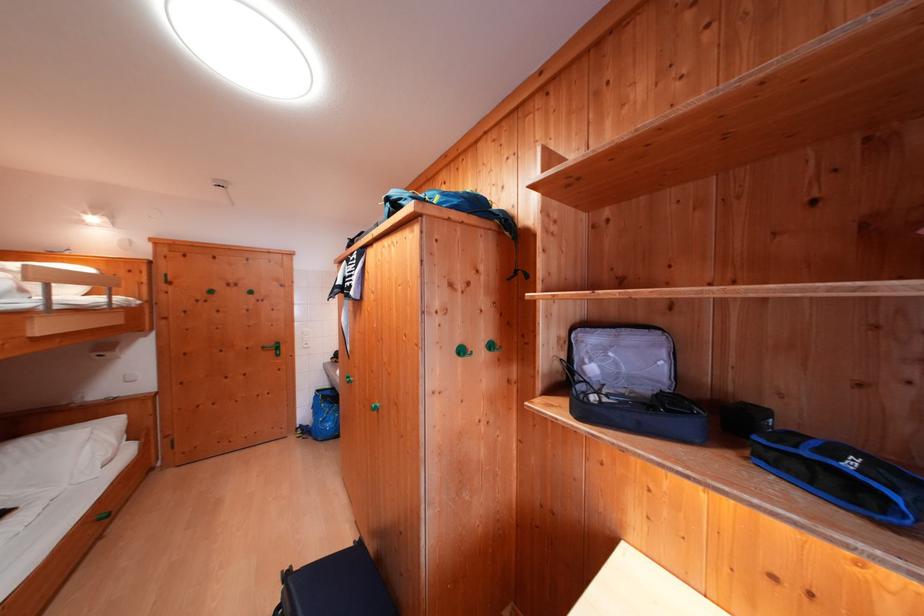
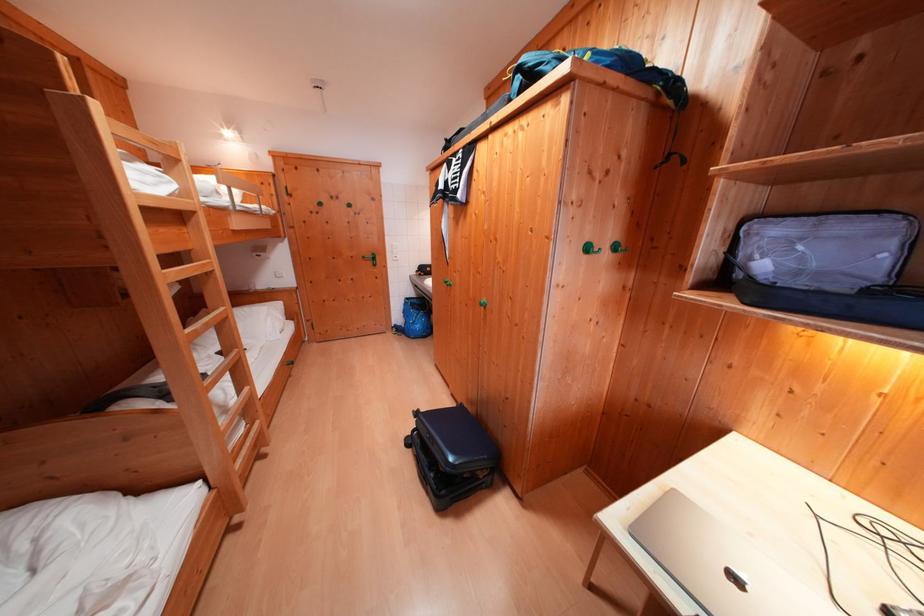
What movement of the cameraman would produce the second image?

The cameraman walked toward left, backward.